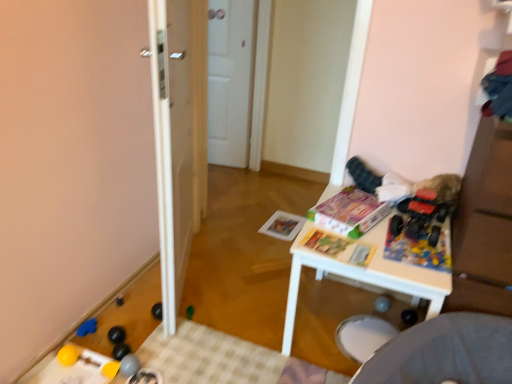
Locate an element on the screen. This screenshot has height=384, width=512. spots to the right of rubberized gray ball at lower left, marked as the third toy in a right-to-left arrangement is located at coordinates (174, 365).